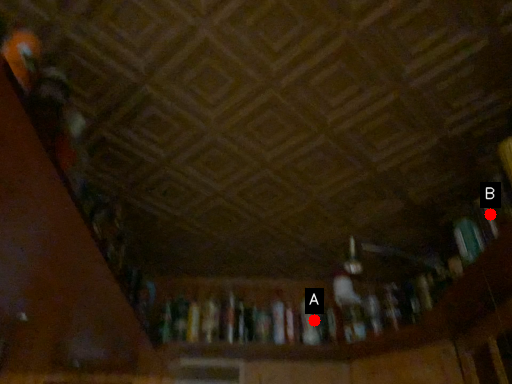
Question: Two points are circled on the image, labeled by A and B beside each circle. Which point is farther from the camera taking this photo?

Choices:
 (A) A is further
 (B) B is further

Answer: (A)